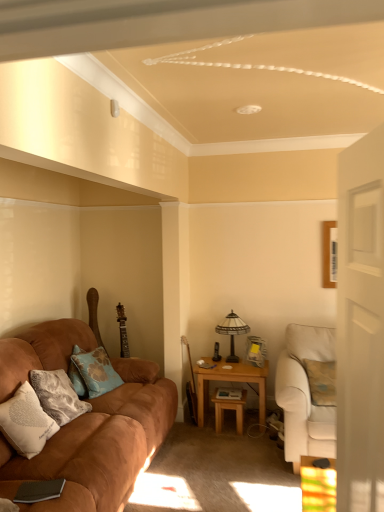
Where is `free spot in front of light brown wooden table at center right, the second table when ordered from left to right`? The image size is (384, 512). free spot in front of light brown wooden table at center right, the second table when ordered from left to right is located at coordinates (244, 442).